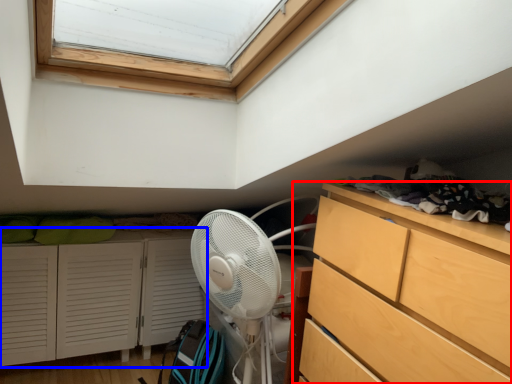
Question: Which object is further to the camera taking this photo, chest of drawers (highlighted by a red box) or cupboard (highlighted by a blue box)?

Choices:
 (A) chest of drawers
 (B) cupboard

Answer: (B)